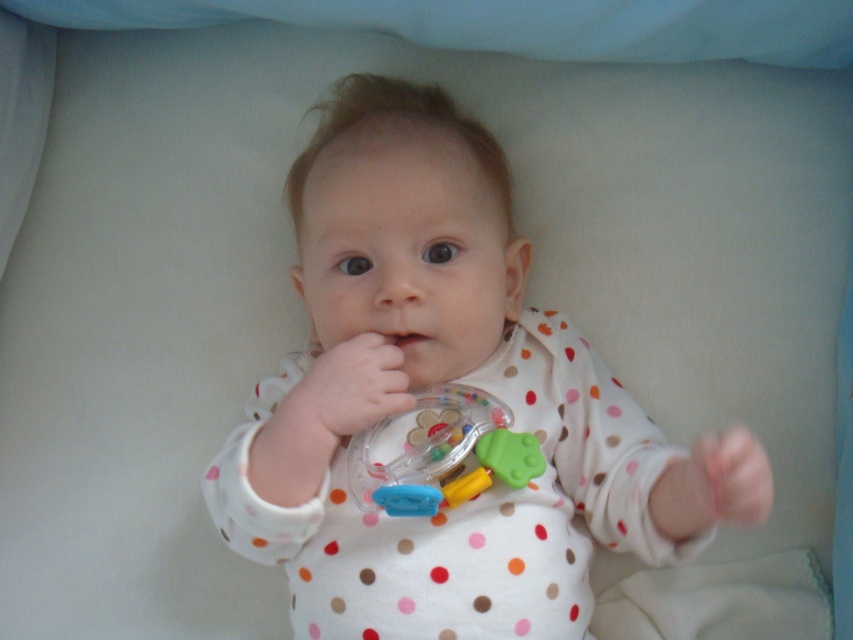
Which is behind, point (408, 499) or point (399, 348)?

The point (399, 348) is behind.

Who is more distant from viewer, (450, 468) or (380, 330)?

The point (380, 330) is behind.

The width and height of the screenshot is (853, 640). In order to click on translucent plastic rattle at center in this screenshot , I will do `click(439, 452)`.

Does white polka dot onesie at center appear on the left side of translucent plastic rattle at center?

Correct, you'll find white polka dot onesie at center to the left of translucent plastic rattle at center.

Does white polka dot onesie at center lie behind translucent plastic rattle at center?

No, it is in front of translucent plastic rattle at center.

Does point (337, 632) lie behind point (372, 483)?

No, it is not.

Locate an element on the screen. Image resolution: width=853 pixels, height=640 pixels. white polka dot onesie at center is located at coordinates (451, 380).

Between white polka dot onesie at center and pink rubber mouth at center, which one has less height?

With less height is pink rubber mouth at center.

Is white polka dot onesie at center positioned in front of pink rubber mouth at center?

Yes, white polka dot onesie at center is closer to the viewer.

Which is behind, point (527, 428) or point (381, 332)?

Point (527, 428)

What are the coordinates of `white polka dot onesie at center` in the screenshot? It's located at (451, 380).